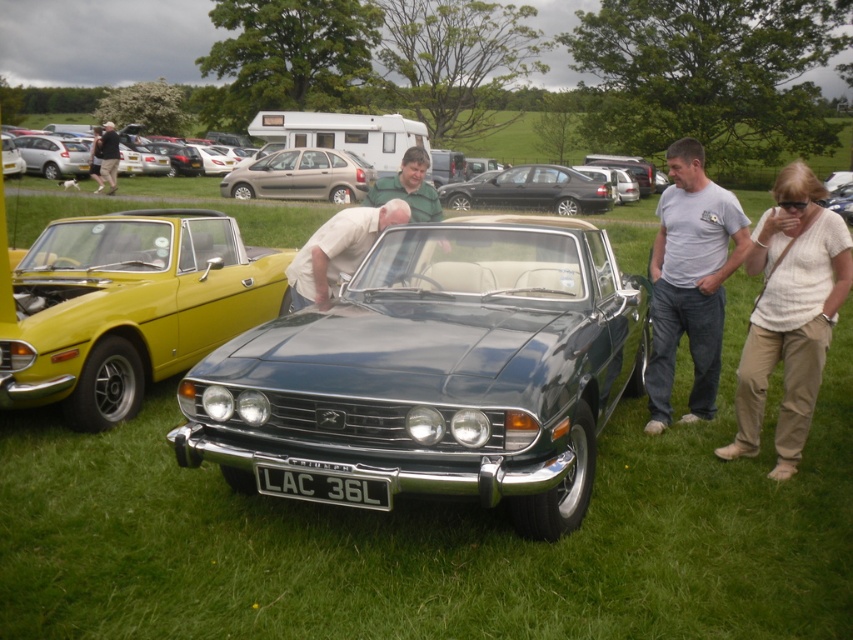
Question: Does matte white shirt at center have a greater width compared to black metal license plate at center?

Choices:
 (A) yes
 (B) no

Answer: (A)

Question: Does black metal license plate at center appear on the right side of satin silver car at center?

Choices:
 (A) no
 (B) yes

Answer: (A)

Question: Which object appears closest to the camera in this image?

Choices:
 (A) dark gray shirt at upper left
 (B) shiny metallic car at center
 (C) matte white shirt at center

Answer: (B)

Question: Which point is farther from the camera taking this photo?

Choices:
 (A) (762, 376)
 (B) (444, 193)
 (C) (421, 218)
 (D) (608, 172)

Answer: (D)

Question: Which point appears farthest from the camera in this image?

Choices:
 (A) (109, 136)
 (B) (595, 172)
 (C) (343, 340)
 (D) (294, 481)

Answer: (B)

Question: Is shiny metallic car at center smaller than black metal license plate at center?

Choices:
 (A) no
 (B) yes

Answer: (A)